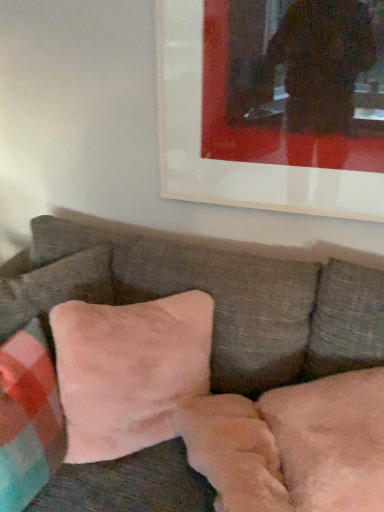
Question: Considering the relative sizes of velvet pink pillow at center, the third pillow from the right, and velvet pink pillow at center in the image provided, is velvet pink pillow at center, the third pillow from the right, taller than velvet pink pillow at center?

Choices:
 (A) yes
 (B) no

Answer: (B)

Question: Does velvet pink pillow at center, placed as the 1th pillow when sorted from left to right, have a smaller size compared to velvet pink pillow at center?

Choices:
 (A) no
 (B) yes

Answer: (B)

Question: From a real-world perspective, does velvet pink pillow at center, placed as the 1th pillow when sorted from left to right, stand above velvet pink pillow at center?

Choices:
 (A) yes
 (B) no

Answer: (A)

Question: Is velvet pink pillow at center, placed as the 1th pillow when sorted from left to right, further to camera compared to velvet pink pillow at center?

Choices:
 (A) yes
 (B) no

Answer: (A)

Question: From the image's perspective, does velvet pink pillow at center, placed as the 1th pillow when sorted from left to right, appear lower than velvet pink pillow at center?

Choices:
 (A) no
 (B) yes

Answer: (A)

Question: Considering the positions of suede-like beige pillow at lower left, the second pillow from the right, and suede-like pink pillow at center, arranged as the third pillow when viewed from the left, in the image, is suede-like beige pillow at lower left, the second pillow from the right, wider or thinner than suede-like pink pillow at center, arranged as the third pillow when viewed from the left,?

Choices:
 (A) wide
 (B) thin

Answer: (B)

Question: Choose the correct answer: Is suede-like beige pillow at lower left, the 2th pillow viewed from the left, inside suede-like pink pillow at center, which appears as the first pillow when viewed from the right, or outside it?

Choices:
 (A) inside
 (B) outside

Answer: (B)

Question: In the image, is suede-like beige pillow at lower left, the second pillow from the right, on the left side or the right side of suede-like pink pillow at center, which appears as the first pillow when viewed from the right?

Choices:
 (A) right
 (B) left

Answer: (B)

Question: From a real-world perspective, is suede-like beige pillow at lower left, the second pillow from the right, physically located above or below suede-like pink pillow at center, arranged as the third pillow when viewed from the left?

Choices:
 (A) below
 (B) above

Answer: (B)

Question: Considering their positions, is velvet pink pillow at center located in front of or behind velvet pink pillow at center, placed as the 1th pillow when sorted from left to right?

Choices:
 (A) front
 (B) behind

Answer: (A)

Question: From a real-world perspective, is velvet pink pillow at center positioned above or below velvet pink pillow at center, placed as the 1th pillow when sorted from left to right?

Choices:
 (A) above
 (B) below

Answer: (B)

Question: From the image's perspective, is velvet pink pillow at center located above or below velvet pink pillow at center, the third pillow from the right?

Choices:
 (A) below
 (B) above

Answer: (A)

Question: Is point (120, 265) closer or farther from the camera than point (19, 384)?

Choices:
 (A) closer
 (B) farther

Answer: (B)

Question: Based on their positions, is suede-like beige pillow at lower left, the 2th pillow viewed from the left, located to the left or right of velvet pink pillow at center, placed as the 1th pillow when sorted from left to right?

Choices:
 (A) left
 (B) right

Answer: (B)

Question: Looking at the image, does suede-like beige pillow at lower left, the second pillow from the right, seem bigger or smaller compared to velvet pink pillow at center, placed as the 1th pillow when sorted from left to right?

Choices:
 (A) big
 (B) small

Answer: (B)